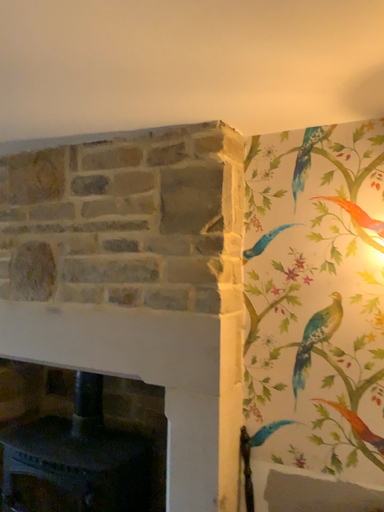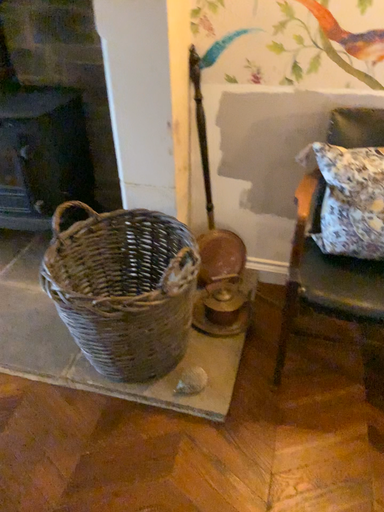
Question: How did the camera likely rotate when shooting the video?

Choices:
 (A) rotated left
 (B) rotated right

Answer: (B)